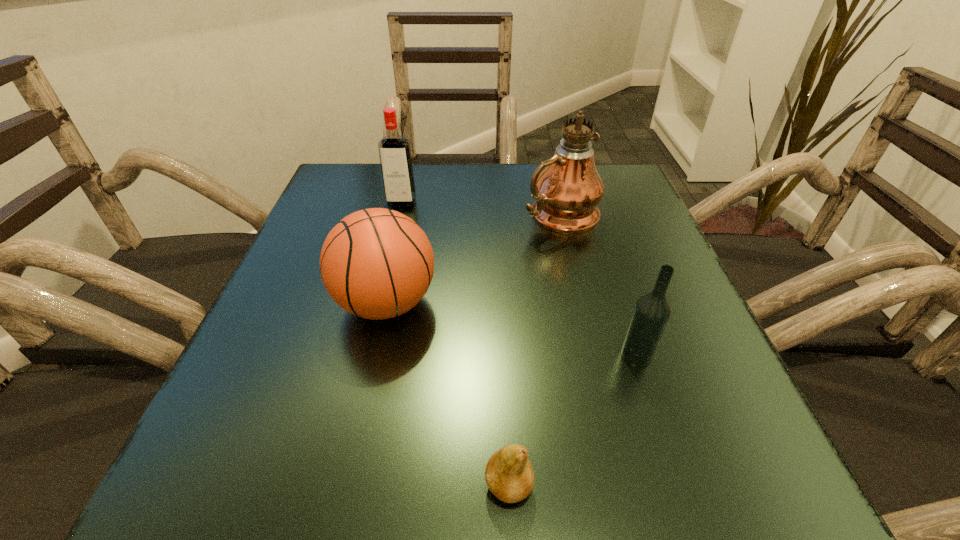
You are a GUI agent. You are given a task and a screenshot of the screen. Output one action in this format:
    pyautogui.click(x=<x>, y=<y>)
    Task: Click on the object that is positioned at the far left corner
    This screenshot has height=540, width=960.
    Given the screenshot: What is the action you would take?
    pyautogui.click(x=394, y=150)

Where is `object at the far right corner`? This screenshot has width=960, height=540. object at the far right corner is located at coordinates (567, 192).

In order to click on free space at the far edge in this screenshot , I will do `click(523, 176)`.

The image size is (960, 540). What are the coordinates of `vacant space at the near edge` in the screenshot? It's located at (621, 487).

The height and width of the screenshot is (540, 960). Identify the location of vacant region at the left edge. pyautogui.click(x=252, y=387).

Where is `vacant space at the right edge of the desktop`? The height and width of the screenshot is (540, 960). vacant space at the right edge of the desktop is located at coordinates (671, 291).

In the image, there is a desktop. Identify the location of vacant region at the far left corner. (319, 199).

This screenshot has width=960, height=540. I want to click on free space at the far right corner of the desktop, so click(632, 192).

Identify the location of free space at the near right corner of the desktop. (745, 479).

I want to click on vacant space that's between the tallest object and the basketball, so click(x=473, y=259).